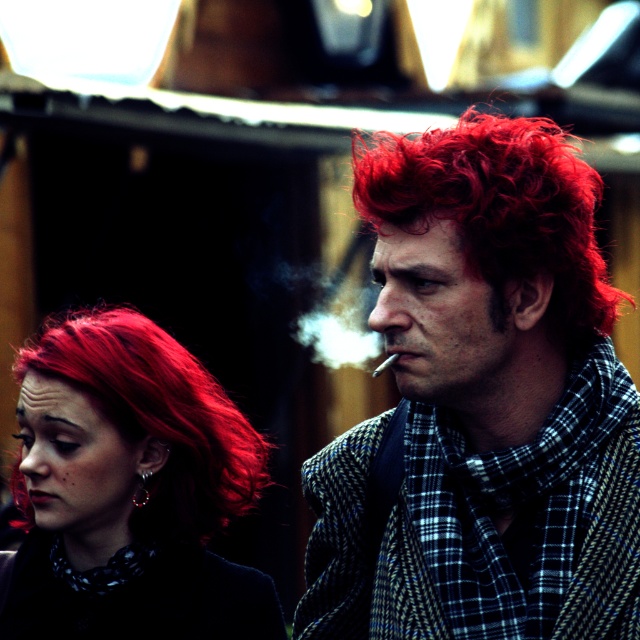
Can you confirm if matte red wig at center is taller than white smoke at center?

Incorrect, matte red wig at center's height is not larger of white smoke at center's.

Can you confirm if matte red wig at center is positioned to the left of white smoke at center?

Incorrect, matte red wig at center is not on the left side of white smoke at center.

Which is behind, point (588, 196) or point (330, 332)?

The point (330, 332) is behind.

You are a GUI agent. You are given a task and a screenshot of the screen. Output one action in this format:
    pyautogui.click(x=<x>, y=<y>)
    Task: Click on the matte red wig at center
    
    Given the screenshot: What is the action you would take?
    (x=484, y=401)

Which is more to the right, shiny red hair at center or curly matte red hair at center?

Positioned to the right is curly matte red hair at center.

Consider the image. Is shiny red hair at center thinner than curly matte red hair at center?

Yes.

Describe the element at coordinates (134, 492) in the screenshot. I see `shiny red hair at center` at that location.

The height and width of the screenshot is (640, 640). What are the coordinates of `shiny red hair at center` in the screenshot? It's located at (134, 492).

Between point (458, 120) and point (353, 304), which one is positioned behind?

The point (458, 120) is more distant.

Is the position of curly matte red hair at center less distant than that of white smoke at center?

Yes.

Is point (580, 301) positioned behind point (353, 276)?

No.

At what (x,y) coordinates should I click in order to perform the action: click on curly matte red hair at center. Please return your answer as a coordinate pair (x, y). The height and width of the screenshot is (640, 640). Looking at the image, I should click on (499, 209).